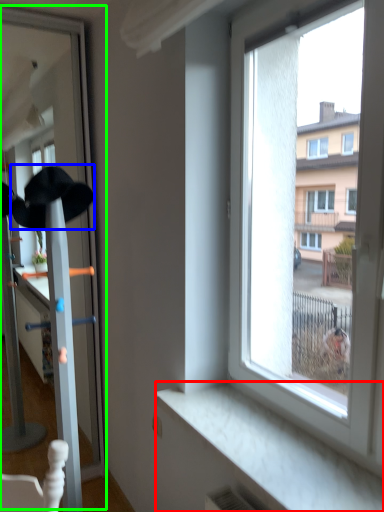
Question: Estimate the real-world distances between objects in this image. Which object is closer to window sill (highlighted by a red box), baseball hat (highlighted by a blue box) or screen door (highlighted by a green box)?

Choices:
 (A) baseball hat
 (B) screen door

Answer: (A)